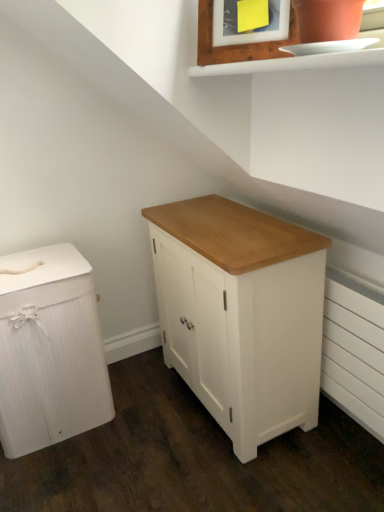
Question: From the image's perspective, is wooden picture frame at upper center located above or below white painted radiator at lower right?

Choices:
 (A) above
 (B) below

Answer: (A)

Question: From a real-world perspective, relative to white painted radiator at lower right, is wooden picture frame at upper center vertically above or below?

Choices:
 (A) above
 (B) below

Answer: (A)

Question: Estimate the real-world distances between objects in this image. Which object is farther from the white painted radiator at lower right?

Choices:
 (A) white wood chest of drawers at left, the second chest of drawers positioned from the right
 (B) wooden picture frame at upper center
 (C) white painted wood cabinet at center, the first chest of drawers viewed from the right

Answer: (A)

Question: Based on their relative distances, which object is farther from the white wood chest of drawers at left, which is the 1th chest of drawers in left-to-right order?

Choices:
 (A) wooden picture frame at upper center
 (B) white painted wood cabinet at center, the first chest of drawers viewed from the right
 (C) white painted radiator at lower right

Answer: (A)